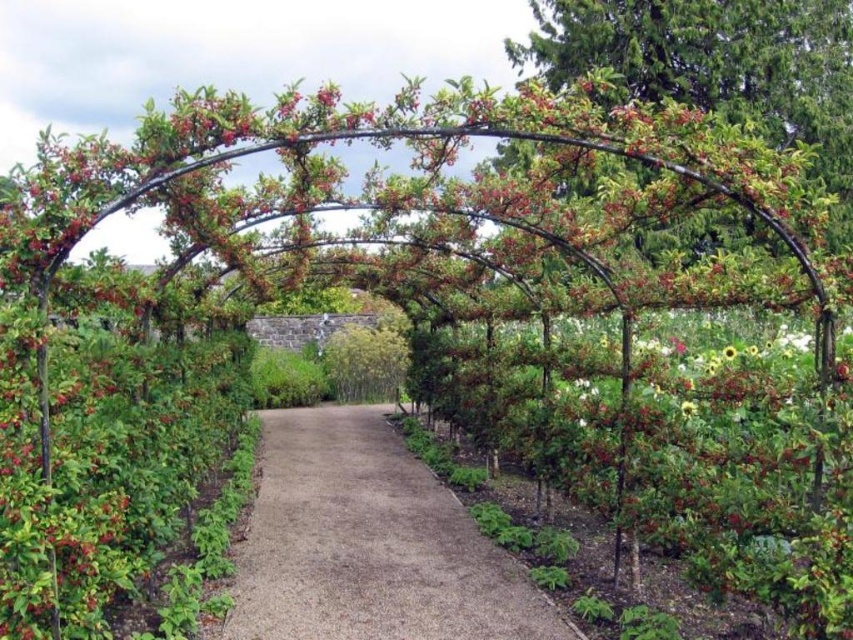
Is green leafy bush at center shorter than yellow matte sunflower at center-right?

In fact, green leafy bush at center may be taller than yellow matte sunflower at center-right.

Which is behind, point (347, 371) or point (689, 408)?

Positioned behind is point (347, 371).

I want to click on green leafy bush at center, so click(364, 364).

Can you confirm if brown gravel path at center is positioned to the left of green leafy bush at center?

No, brown gravel path at center is not to the left of green leafy bush at center.

Locate an element on the screen. The image size is (853, 640). brown gravel path at center is located at coordinates (369, 545).

Which is behind, point (305, 410) or point (395, 352)?

Point (395, 352)

You are a GUI agent. You are given a task and a screenshot of the screen. Output one action in this format:
    pyautogui.click(x=<x>, y=<y>)
    Task: Click on the brown gravel path at center
    Image resolution: width=853 pixels, height=640 pixels.
    Given the screenshot: What is the action you would take?
    369,545

In the scene shown: Is the position of brown gravel path at center more distant than that of yellow matte sunflower at center-right?

Yes.

Can you confirm if brown gravel path at center is taller than yellow matte sunflower at center-right?

In fact, brown gravel path at center may be shorter than yellow matte sunflower at center-right.

Which is behind, point (444, 584) or point (689, 406)?

Point (689, 406)

Locate an element on the screen. brown gravel path at center is located at coordinates (369, 545).